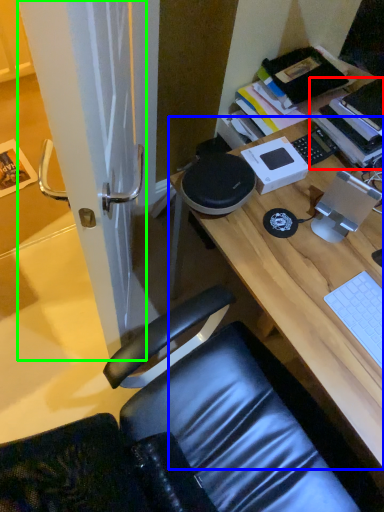
Question: Considering the real-world distances, which object is farthest from book (highlighted by a red box)? desk (highlighted by a blue box) or screen door (highlighted by a green box)?

Choices:
 (A) desk
 (B) screen door

Answer: (B)